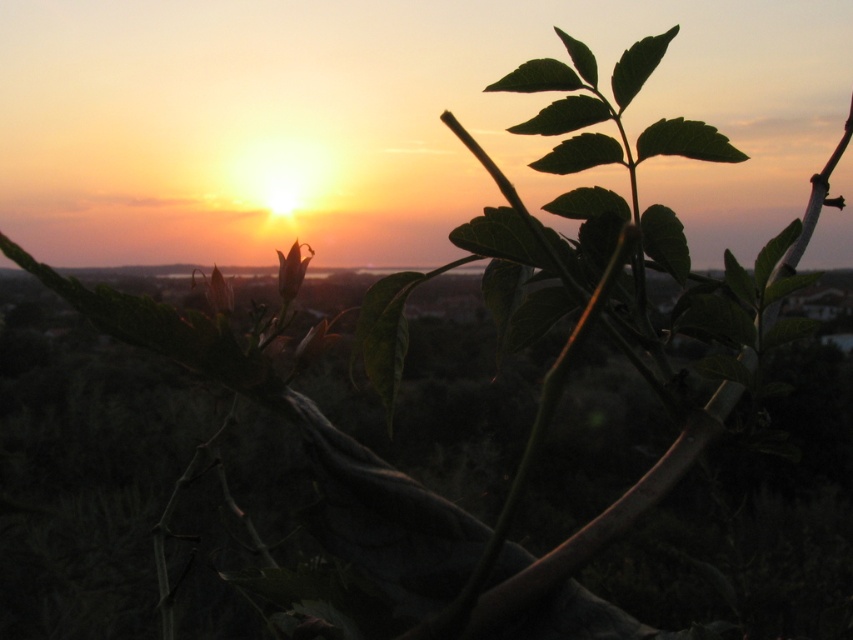
Describe the element at coordinates (292, 269) in the screenshot. The height and width of the screenshot is (640, 853). I see `translucent orange flower at center` at that location.

In the scene shown: Can you confirm if translucent orange flower at center is smaller than green matte flower at center?

Yes, translucent orange flower at center is smaller than green matte flower at center.

Locate an element on the screen. The height and width of the screenshot is (640, 853). translucent orange flower at center is located at coordinates (292, 269).